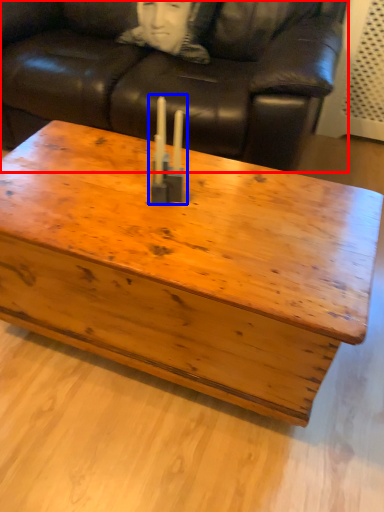
Question: Among these objects, which one is farthest to the camera, studio couch (highlighted by a red box) or candle holder (highlighted by a blue box)?

Choices:
 (A) studio couch
 (B) candle holder

Answer: (A)